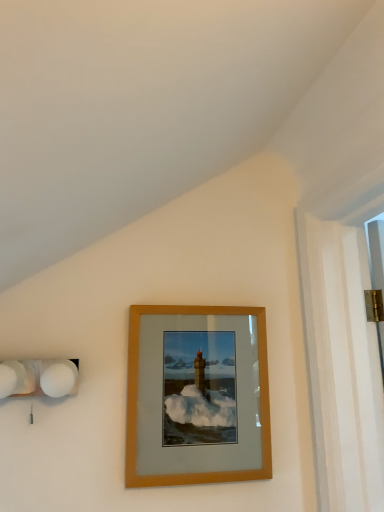
Question: Is point (49, 376) closer or farther from the camera than point (135, 398)?

Choices:
 (A) closer
 (B) farther

Answer: (A)

Question: Is white matte spherical lamps at left taller or shorter than wooden frame at center?

Choices:
 (A) short
 (B) tall

Answer: (A)

Question: Based on their sizes in the image, would you say white matte spherical lamps at left is bigger or smaller than wooden frame at center?

Choices:
 (A) big
 (B) small

Answer: (B)

Question: Is wooden frame at center wider or thinner than white matte spherical lamps at left?

Choices:
 (A) wide
 (B) thin

Answer: (B)

Question: Considering the relative positions of wooden frame at center and white matte spherical lamps at left in the image provided, is wooden frame at center to the left or to the right of white matte spherical lamps at left?

Choices:
 (A) left
 (B) right

Answer: (B)

Question: Looking at the image, does wooden frame at center seem bigger or smaller compared to white matte spherical lamps at left?

Choices:
 (A) big
 (B) small

Answer: (A)

Question: From the image's perspective, is wooden frame at center located above or below white matte spherical lamps at left?

Choices:
 (A) above
 (B) below

Answer: (B)